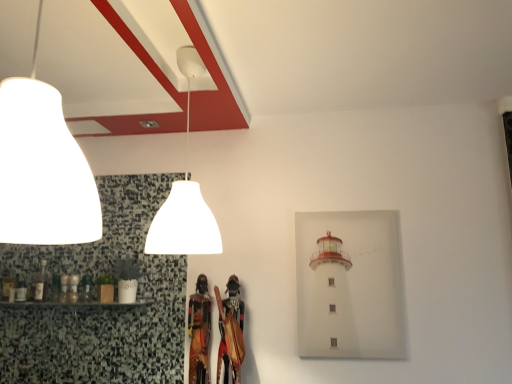
Find the location of `matte white lampshade at upper left, marked as the second lamp in a back-to-front arrangement`. matte white lampshade at upper left, marked as the second lamp in a back-to-front arrangement is located at coordinates (42, 168).

What do you see at coordinates (42, 168) in the screenshot?
I see `matte white lampshade at upper left, marked as the second lamp in a back-to-front arrangement` at bounding box center [42, 168].

The height and width of the screenshot is (384, 512). What do you see at coordinates (185, 196) in the screenshot?
I see `white matte lampshade at upper center, positioned as the first lamp in back-to-front order` at bounding box center [185, 196].

At what (x,y) coordinates should I click in order to perform the action: click on white matte lampshade at upper center, positioned as the first lamp in back-to-front order. Please return your answer as a coordinate pair (x, y). The image size is (512, 384). Looking at the image, I should click on (185, 196).

Identify the location of matte white lampshade at upper left, marked as the second lamp in a back-to-front arrangement. The width and height of the screenshot is (512, 384). (42, 168).

Does white matte lampshade at upper center, the 2th lamp in the front-to-back sequence, appear on the right side of matte white lampshade at upper left, marked as the second lamp in a back-to-front arrangement?

Yes, white matte lampshade at upper center, the 2th lamp in the front-to-back sequence, is to the right of matte white lampshade at upper left, marked as the second lamp in a back-to-front arrangement.

Does white matte lampshade at upper center, positioned as the first lamp in back-to-front order, lie in front of matte white lampshade at upper left, marked as the second lamp in a back-to-front arrangement?

No, white matte lampshade at upper center, positioned as the first lamp in back-to-front order, is further to the viewer.

Between point (189, 226) and point (54, 217), which one is positioned in front?

The point (54, 217) is more forward.

From the image's perspective, is white matte lampshade at upper center, positioned as the first lamp in back-to-front order, below matte white lampshade at upper left, the 1th lamp when ordered from front to back?

Yes, from the image's perspective, white matte lampshade at upper center, positioned as the first lamp in back-to-front order, is below matte white lampshade at upper left, the 1th lamp when ordered from front to back.

From a real-world perspective, is white matte lampshade at upper center, the 2th lamp in the front-to-back sequence, under matte white lampshade at upper left, the 1th lamp when ordered from front to back?

No, from a real-world perspective, white matte lampshade at upper center, the 2th lamp in the front-to-back sequence, is not under matte white lampshade at upper left, the 1th lamp when ordered from front to back.

Between white matte lampshade at upper center, positioned as the first lamp in back-to-front order, and matte white lampshade at upper left, the 1th lamp when ordered from front to back, which one has larger width?

white matte lampshade at upper center, positioned as the first lamp in back-to-front order.

Which of these two, white matte lampshade at upper center, positioned as the first lamp in back-to-front order, or matte white lampshade at upper left, the 1th lamp when ordered from front to back, stands taller?

white matte lampshade at upper center, positioned as the first lamp in back-to-front order, is taller.

From the picture: Considering the relative sizes of white matte lampshade at upper center, positioned as the first lamp in back-to-front order, and matte white lampshade at upper left, marked as the second lamp in a back-to-front arrangement, in the image provided, is white matte lampshade at upper center, positioned as the first lamp in back-to-front order, bigger than matte white lampshade at upper left, marked as the second lamp in a back-to-front arrangement,?

Correct, white matte lampshade at upper center, positioned as the first lamp in back-to-front order, is larger in size than matte white lampshade at upper left, marked as the second lamp in a back-to-front arrangement.

Can matte white lampshade at upper left, the 1th lamp when ordered from front to back, be found inside white matte lampshade at upper center, the 2th lamp in the front-to-back sequence?

Definitely not — matte white lampshade at upper left, the 1th lamp when ordered from front to back, is not inside white matte lampshade at upper center, the 2th lamp in the front-to-back sequence.

Is white matte lampshade at upper center, positioned as the first lamp in back-to-front order, positioned far away from matte white lampshade at upper left, the 1th lamp when ordered from front to back?

white matte lampshade at upper center, positioned as the first lamp in back-to-front order, is near matte white lampshade at upper left, the 1th lamp when ordered from front to back, not far away.

In the scene shown: Is white matte lampshade at upper center, the 2th lamp in the front-to-back sequence, turned away from matte white lampshade at upper left, marked as the second lamp in a back-to-front arrangement?

white matte lampshade at upper center, the 2th lamp in the front-to-back sequence, is not turned away from matte white lampshade at upper left, marked as the second lamp in a back-to-front arrangement.

How many degrees apart are the facing directions of white matte lampshade at upper center, the 2th lamp in the front-to-back sequence, and matte white lampshade at upper left, the 1th lamp when ordered from front to back?

2.74 degrees separate the facing orientations of white matte lampshade at upper center, the 2th lamp in the front-to-back sequence, and matte white lampshade at upper left, the 1th lamp when ordered from front to back.

Could you measure the distance between white matte lampshade at upper center, the 2th lamp in the front-to-back sequence, and matte white lampshade at upper left, marked as the second lamp in a back-to-front arrangement?

They are 28.61 inches apart.

At what (x,y) coordinates should I click in order to perform the action: click on lamp that is above the white matte lampshade at upper center, the 2th lamp in the front-to-back sequence (from the image's perspective). Please return your answer as a coordinate pair (x, y). This screenshot has width=512, height=384. Looking at the image, I should click on (42, 168).

Considering the positions of objects matte white lampshade at upper left, marked as the second lamp in a back-to-front arrangement, and white matte lampshade at upper center, the 2th lamp in the front-to-back sequence, in the image provided, who is more to the left, matte white lampshade at upper left, marked as the second lamp in a back-to-front arrangement, or white matte lampshade at upper center, the 2th lamp in the front-to-back sequence,?

From the viewer's perspective, matte white lampshade at upper left, marked as the second lamp in a back-to-front arrangement, appears more on the left side.

Between matte white lampshade at upper left, marked as the second lamp in a back-to-front arrangement, and white matte lampshade at upper center, the 2th lamp in the front-to-back sequence, which one is positioned behind?

white matte lampshade at upper center, the 2th lamp in the front-to-back sequence, is behind.

Does point (39, 175) appear closer or farther from the camera than point (179, 69)?

Point (39, 175) is closer to the camera than point (179, 69).

From the image's perspective, between matte white lampshade at upper left, marked as the second lamp in a back-to-front arrangement, and white matte lampshade at upper center, positioned as the first lamp in back-to-front order, which one is located above?

matte white lampshade at upper left, marked as the second lamp in a back-to-front arrangement, appears higher in the image.

From a real-world perspective, is matte white lampshade at upper left, the 1th lamp when ordered from front to back, on white matte lampshade at upper center, positioned as the first lamp in back-to-front order?

Incorrect, from a real-world perspective, matte white lampshade at upper left, the 1th lamp when ordered from front to back, is lower than white matte lampshade at upper center, positioned as the first lamp in back-to-front order.

Which of these two, matte white lampshade at upper left, the 1th lamp when ordered from front to back, or white matte lampshade at upper center, the 2th lamp in the front-to-back sequence, is wider?

white matte lampshade at upper center, the 2th lamp in the front-to-back sequence.

Between matte white lampshade at upper left, the 1th lamp when ordered from front to back, and white matte lampshade at upper center, positioned as the first lamp in back-to-front order, which one has less height?

Standing shorter between the two is matte white lampshade at upper left, the 1th lamp when ordered from front to back.

Considering the relative sizes of matte white lampshade at upper left, marked as the second lamp in a back-to-front arrangement, and white matte lampshade at upper center, the 2th lamp in the front-to-back sequence, in the image provided, is matte white lampshade at upper left, marked as the second lamp in a back-to-front arrangement, bigger than white matte lampshade at upper center, the 2th lamp in the front-to-back sequence,?

Actually, matte white lampshade at upper left, marked as the second lamp in a back-to-front arrangement, might be smaller than white matte lampshade at upper center, the 2th lamp in the front-to-back sequence.

Which is correct: matte white lampshade at upper left, the 1th lamp when ordered from front to back, is inside white matte lampshade at upper center, positioned as the first lamp in back-to-front order, or outside of it?

matte white lampshade at upper left, the 1th lamp when ordered from front to back, exists outside the volume of white matte lampshade at upper center, positioned as the first lamp in back-to-front order.

Is matte white lampshade at upper left, the 1th lamp when ordered from front to back, directly adjacent to white matte lampshade at upper center, the 2th lamp in the front-to-back sequence?

matte white lampshade at upper left, the 1th lamp when ordered from front to back, and white matte lampshade at upper center, the 2th lamp in the front-to-back sequence, are not in contact.

Consider the image. Is matte white lampshade at upper left, the 1th lamp when ordered from front to back, oriented towards white matte lampshade at upper center, positioned as the first lamp in back-to-front order?

No, matte white lampshade at upper left, the 1th lamp when ordered from front to back, does not turn towards white matte lampshade at upper center, positioned as the first lamp in back-to-front order.

Where is `lamp in front of the white matte lampshade at upper center, the 2th lamp in the front-to-back sequence`? The width and height of the screenshot is (512, 384). lamp in front of the white matte lampshade at upper center, the 2th lamp in the front-to-back sequence is located at coordinates (42, 168).

I want to click on lamp located underneath the white matte lampshade at upper center, positioned as the first lamp in back-to-front order (from a real-world perspective), so click(x=42, y=168).

The image size is (512, 384). Identify the location of lamp in front of the white matte lampshade at upper center, positioned as the first lamp in back-to-front order. (42, 168).